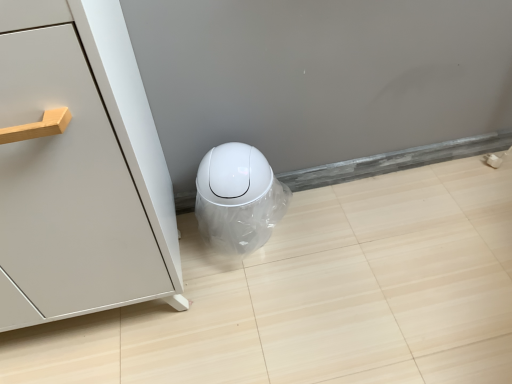
Where is `unoccupied area in front of white glossy trash can at lower center`? The image size is (512, 384). unoccupied area in front of white glossy trash can at lower center is located at coordinates (246, 283).